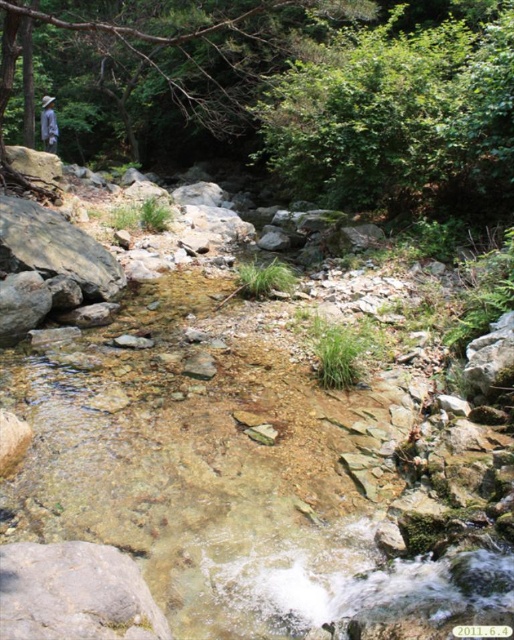
Question: Among these points, which one is farthest from the camera?

Choices:
 (A) (x=52, y=136)
 (B) (x=128, y=522)

Answer: (A)

Question: Does clear rock water at center appear under blue fabric shirt at upper left?

Choices:
 (A) yes
 (B) no

Answer: (A)

Question: Does clear rock water at center have a smaller size compared to blue fabric shirt at upper left?

Choices:
 (A) yes
 (B) no

Answer: (B)

Question: Is clear rock water at center smaller than blue fabric shirt at upper left?

Choices:
 (A) yes
 (B) no

Answer: (B)